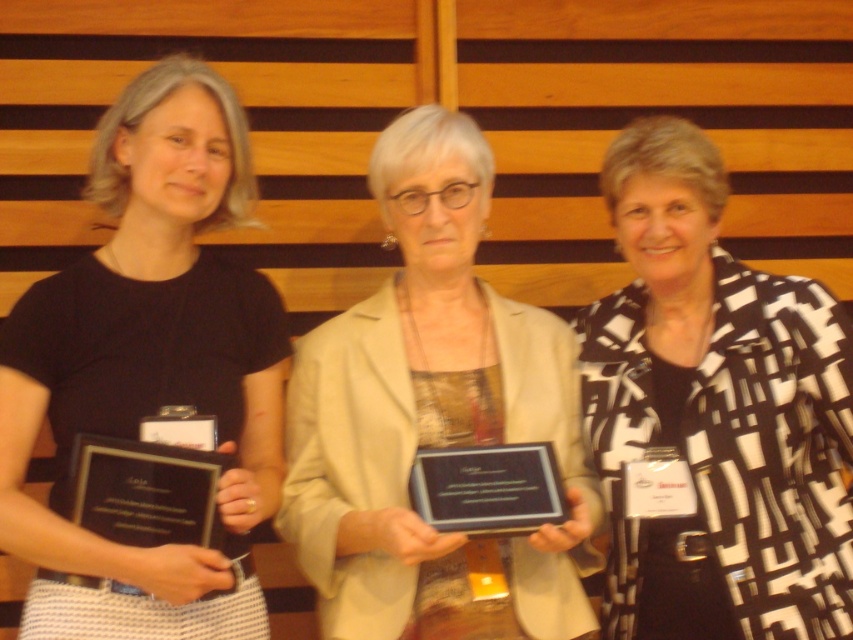
You are a photographer who needs to adjust the lighting to ensure both the black and white patterned blazer at center and the black glossy plaque at left are clearly visible. Which object should you focus the light on first to avoid shadows obscuring their details?

The black and white patterned blazer at center is above the black glossy plaque at left, so you should focus the light on the black and white patterned blazer at center first to prevent its shadow from covering the plaque below.

You are an event planner arranging a photo shoot. You need to position a 1.2 meter tall stand for the black glossy plaque at left so it is visible behind the black and white patterned blazer at center. Is the stand tall enough?

The black and white patterned blazer at center is taller than the black glossy plaque at left. Therefore, the 1.2 meter stand may not be sufficient because the blazer is taller than the plaque, potentially obscuring it.